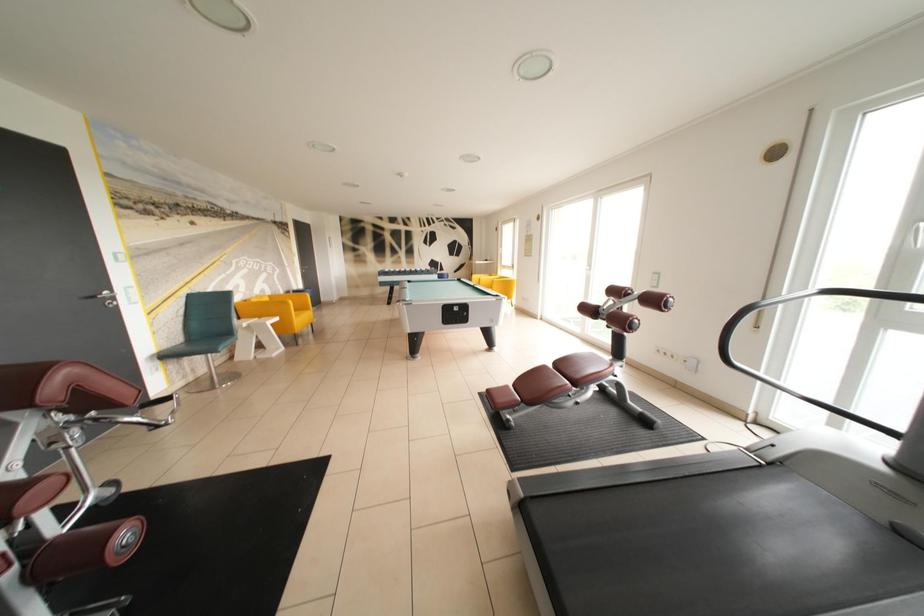
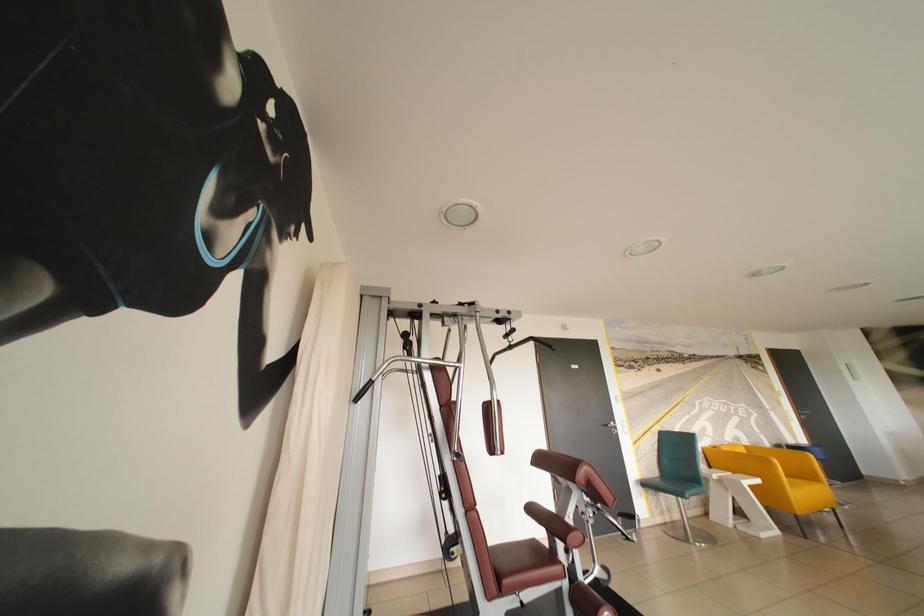
The first image is from the beginning of the video and the second image is from the end. How did the camera likely rotate when shooting the video?

The rotation direction of the camera is left-up.